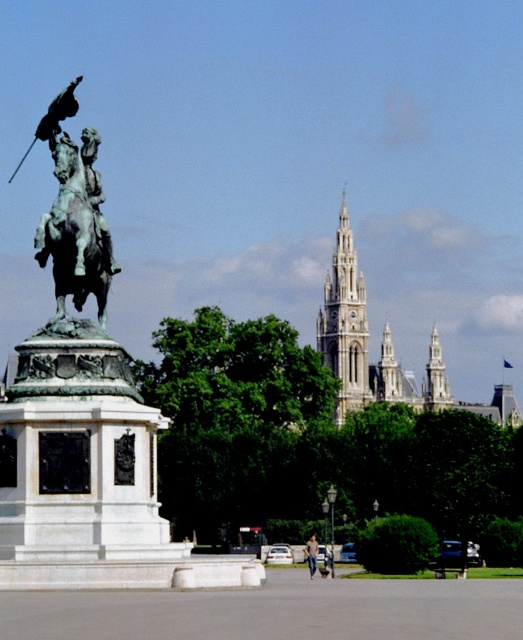
From the picture: You are a delivery person trying to navigate through the area between the green patina horse at center and the dark blue jeans at center. Can you pass through this space if your delivery cart is 1.2 meters wide?

The green patina horse at center might be wider than dark blue jeans at center, so the space between them may not be wide enough for the delivery cart. Check the actual distance before proceeding.